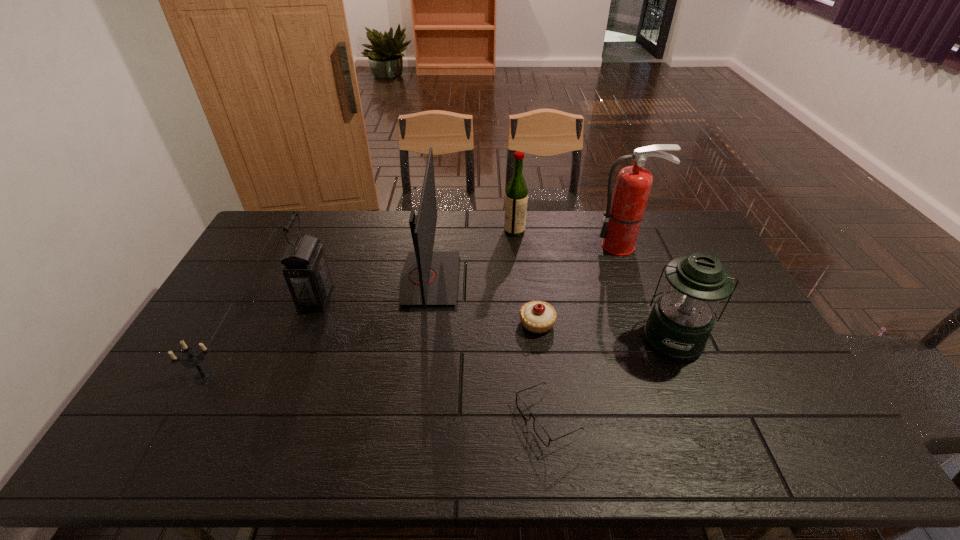
Find the location of a particular element. This screenshot has width=960, height=540. vacant space at the left edge is located at coordinates (227, 323).

At what (x,y) coordinates should I click in order to perform the action: click on free space at the right edge of the desktop. Please return your answer as a coordinate pair (x, y). Image resolution: width=960 pixels, height=540 pixels. Looking at the image, I should click on (754, 332).

Identify the location of vacant region at the far left corner of the desktop. Image resolution: width=960 pixels, height=540 pixels. (309, 219).

Identify the location of vacant area at the far right corner of the desktop. (667, 235).

The width and height of the screenshot is (960, 540). Find the location of `free space between the candle holder and the sixth object from right to left`. free space between the candle holder and the sixth object from right to left is located at coordinates (317, 328).

The width and height of the screenshot is (960, 540). Find the location of `vacant area between the right lantern and the pastry`. vacant area between the right lantern and the pastry is located at coordinates (605, 330).

Identify the location of free spot between the seventh object from right to left and the third object from left to right. This screenshot has height=540, width=960. (372, 288).

Identify the location of empty space that is in between the nearest object and the second shortest object. The width and height of the screenshot is (960, 540). (542, 370).

At what (x,y) coordinates should I click in order to perform the action: click on free space between the shortest object and the fire extinguisher. Please return your answer as a coordinate pair (x, y). Image resolution: width=960 pixels, height=540 pixels. Looking at the image, I should click on (585, 332).

Locate an element on the screen. The height and width of the screenshot is (540, 960). vacant area that lies between the second object from left to right and the fire extinguisher is located at coordinates (469, 272).